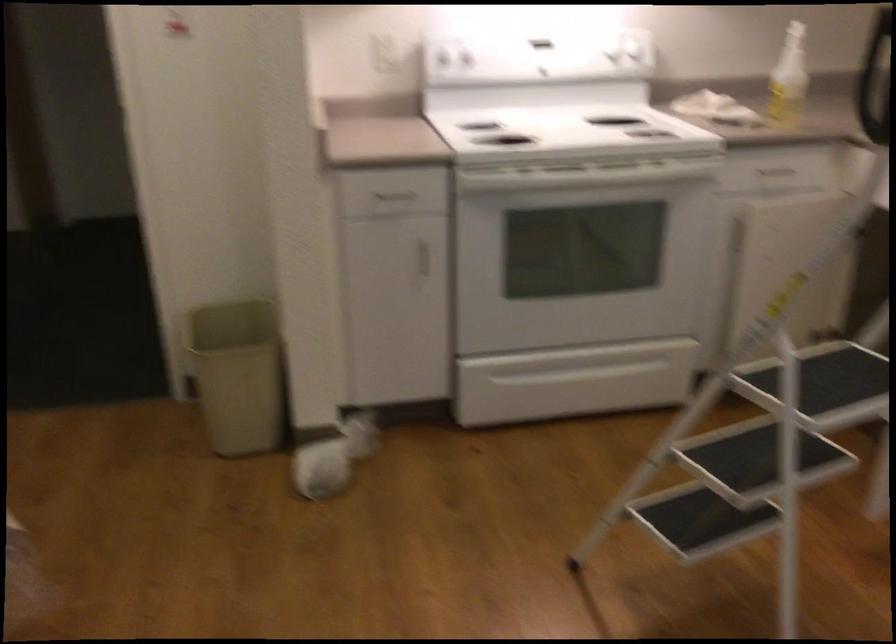
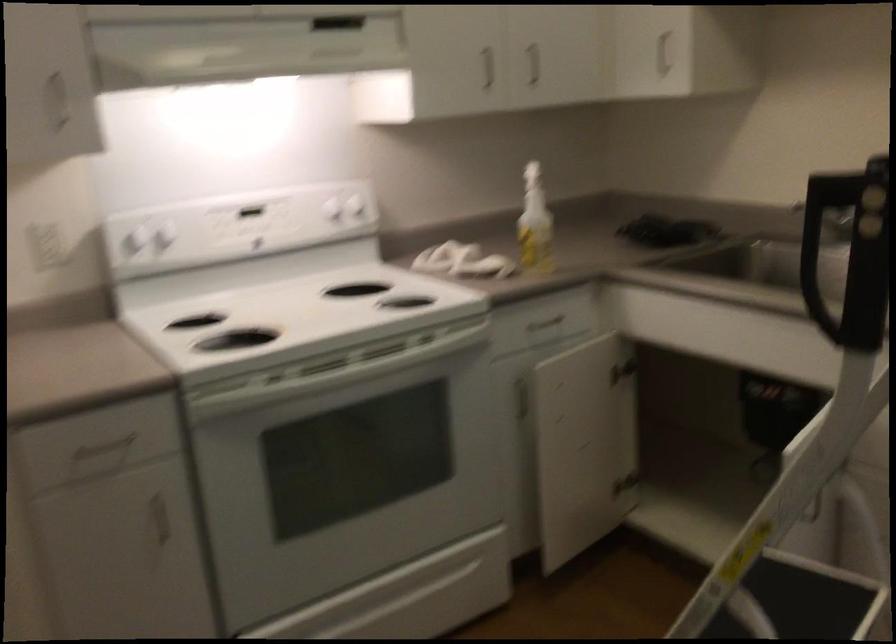
Question: The images are taken continuously from a first-person perspective. In which direction is your viewpoint rotating?

Choices:
 (A) Left
 (B) Right
 (C) Up
 (D) Down

Answer: (B)